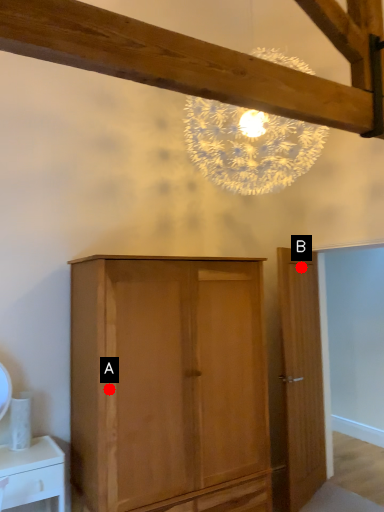
Question: Two points are circled on the image, labeled by A and B beside each circle. Which point appears closest to the camera in this image?

Choices:
 (A) A is closer
 (B) B is closer

Answer: (A)